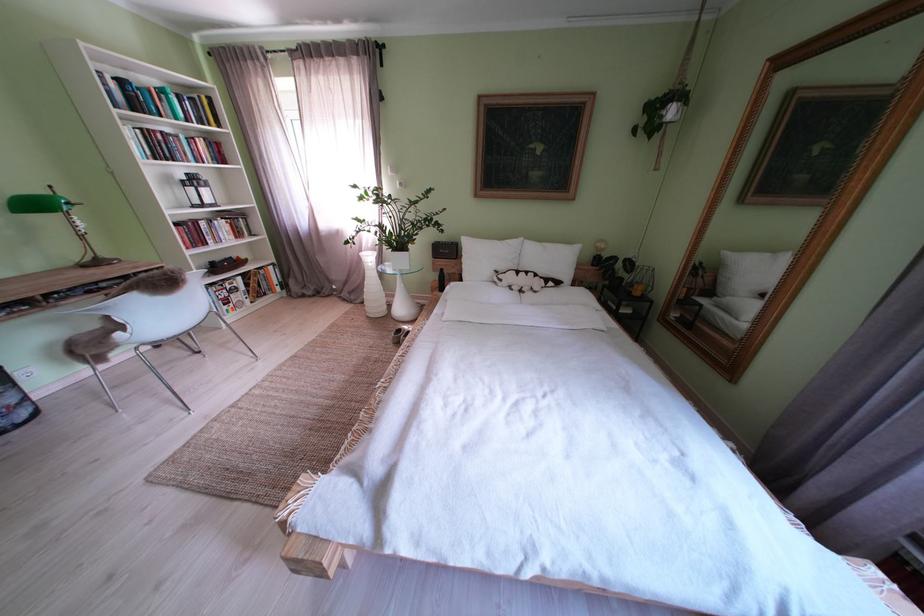
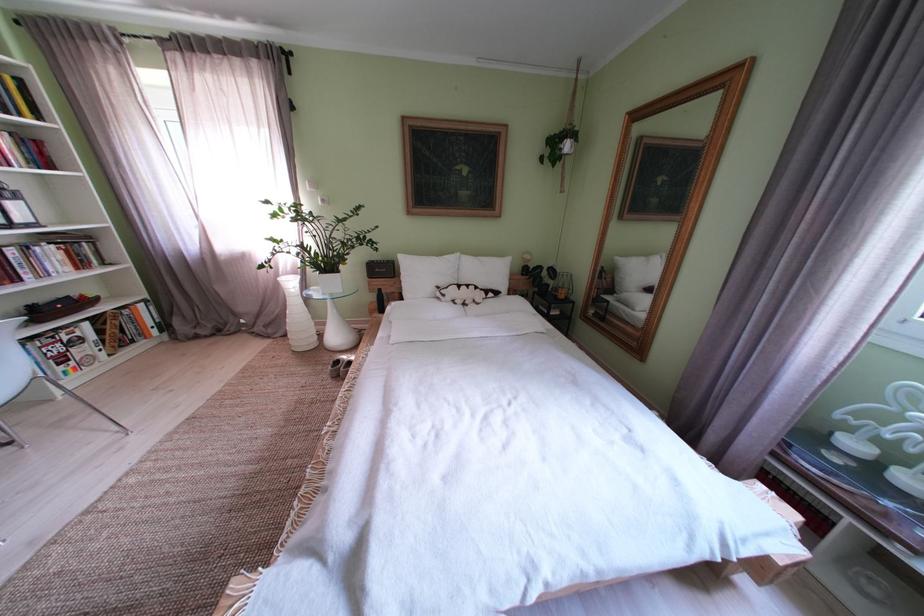
Find the pixel in the second image that matches pixel 410 336 in the first image.

(348, 367)